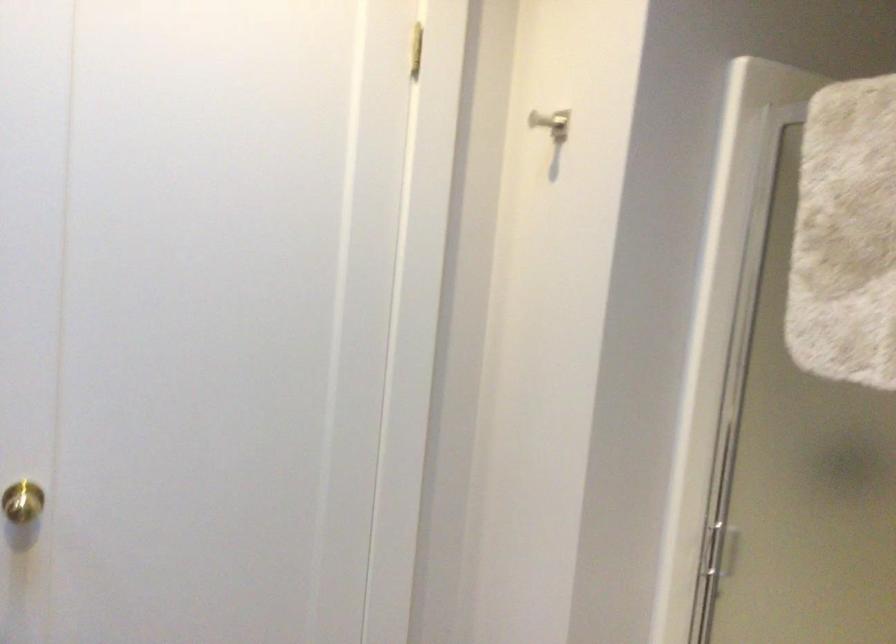
Where would you pull the shower door handle? Please return your answer as a coordinate pair (x, y).

(716, 550)